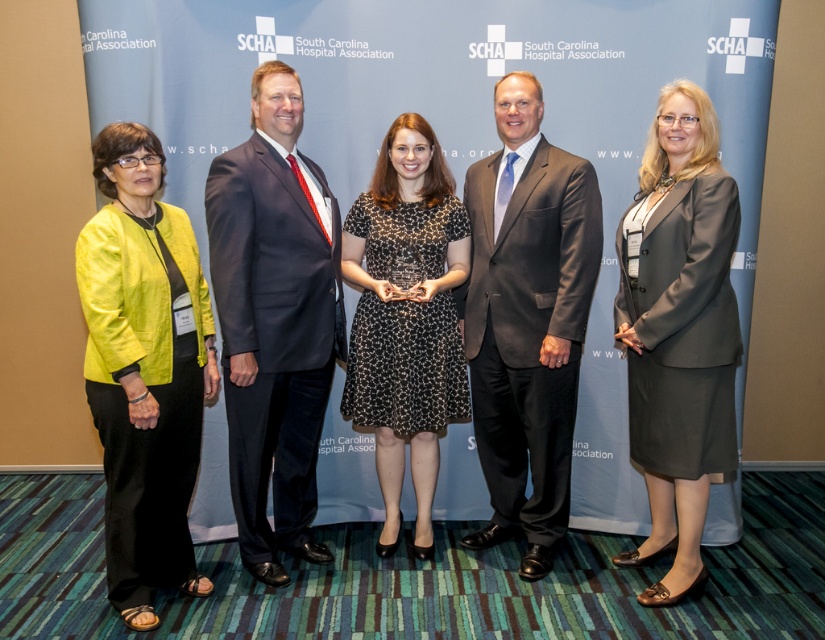
Based on the photo, you are organizing a photo shoot for a professional event. In the image provided, there are two key individuals wearing a dark blue suit at center and a matte gray suit at right. From the perspective of someone standing in front of the photo, which individual is positioned to the left of the other?

The dark blue suit at center is positioned to the left of the matte gray suit at right.

You are a photographer adjusting your camera settings to focus on both the matte yellow blazer at left and the black dotted dress at center. Which object should you focus on first to ensure proper depth of field?

The matte yellow blazer at left is closer to the viewer than the black dotted dress at center, so you should focus on the matte yellow blazer at left first to ensure proper depth of field.